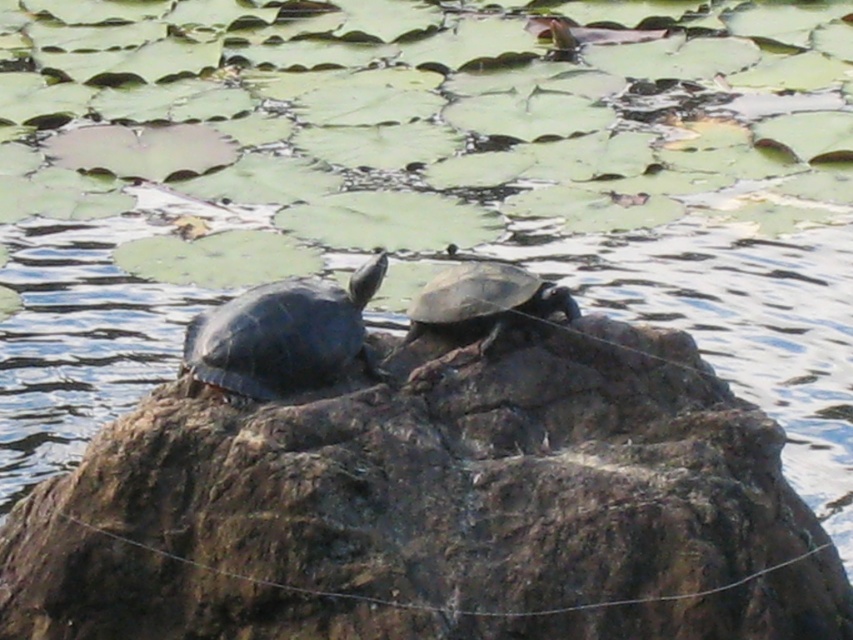
Question: Based on their relative distances, which object is nearer to the shiny black tortoise at center?

Choices:
 (A) shiny brown tortoise at center
 (B) brown rough rock at center

Answer: (A)

Question: Is brown rough rock at center to the left of shiny brown tortoise at center from the viewer's perspective?

Choices:
 (A) no
 (B) yes

Answer: (B)

Question: Can you confirm if shiny black tortoise at center is positioned to the right of shiny brown tortoise at center?

Choices:
 (A) yes
 (B) no

Answer: (B)

Question: Is shiny black tortoise at center above shiny brown tortoise at center?

Choices:
 (A) yes
 (B) no

Answer: (B)

Question: Which point appears farthest from the camera in this image?

Choices:
 (A) (465, 262)
 (B) (367, 458)
 (C) (335, 321)

Answer: (A)

Question: Which is nearer to the shiny brown tortoise at center?

Choices:
 (A) brown rough rock at center
 (B) shiny black tortoise at center

Answer: (B)